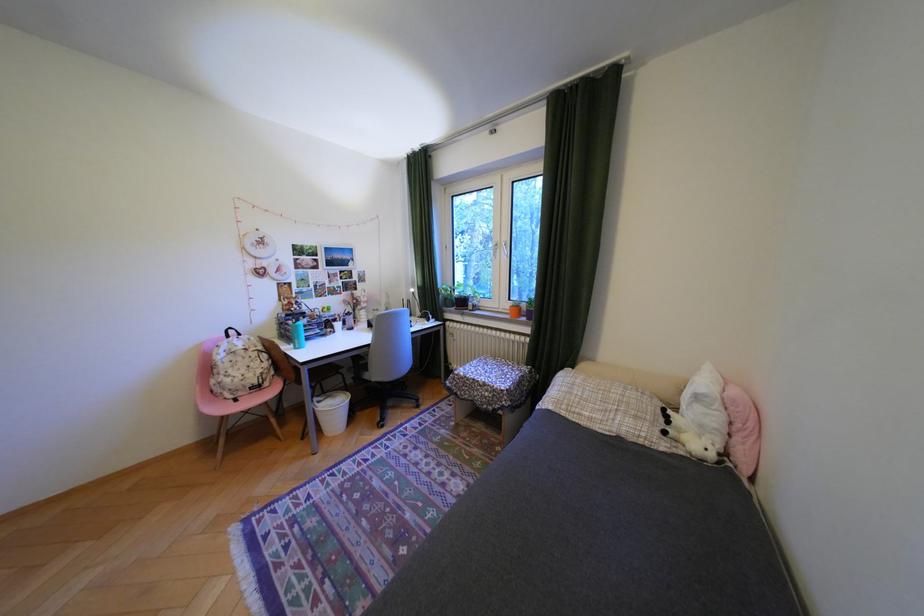
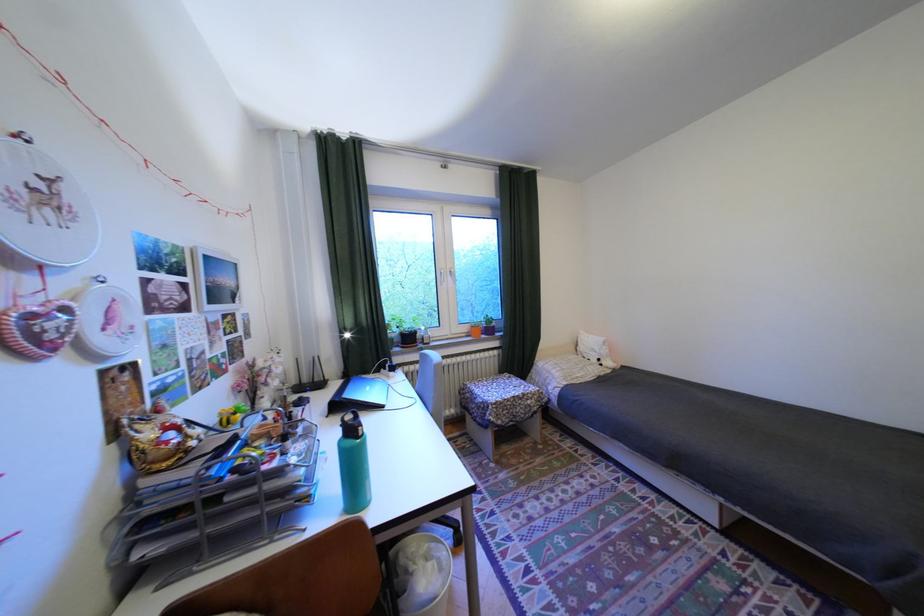
Find the pixel in the second image that matches (470,392) in the first image.

(512, 422)